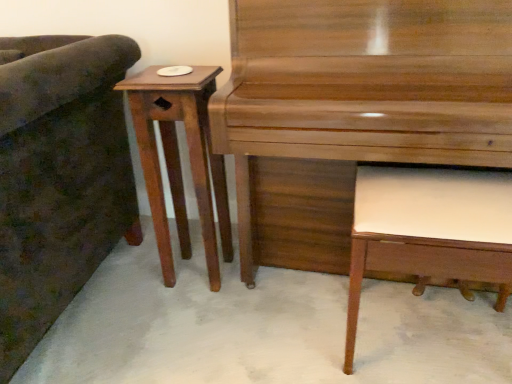
Locate an element on the screen. Image resolution: width=512 pixels, height=384 pixels. vacant space situated on the left part of mahogany wood side table at left is located at coordinates (133, 277).